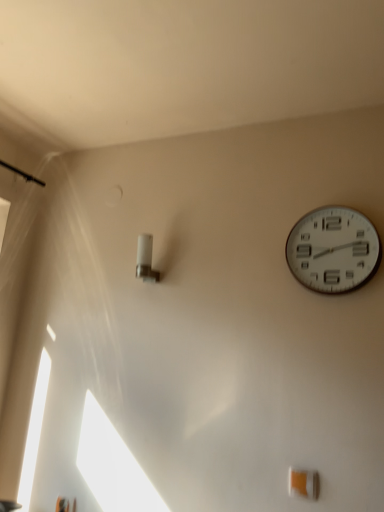
Question: Considering the relative sizes of white plastic light fixture at center-left and white plastic wall clock at upper right in the image provided, is white plastic light fixture at center-left wider than white plastic wall clock at upper right?

Choices:
 (A) no
 (B) yes

Answer: (B)

Question: From a real-world perspective, is white plastic light fixture at center-left located higher than white plastic wall clock at upper right?

Choices:
 (A) no
 (B) yes

Answer: (A)

Question: From the image's perspective, is white plastic light fixture at center-left located above white plastic wall clock at upper right?

Choices:
 (A) yes
 (B) no

Answer: (B)

Question: From the image's perspective, does white plastic light fixture at center-left appear lower than white plastic wall clock at upper right?

Choices:
 (A) yes
 (B) no

Answer: (A)

Question: Are white plastic light fixture at center-left and white plastic wall clock at upper right far apart?

Choices:
 (A) no
 (B) yes

Answer: (A)

Question: Can you confirm if white plastic light fixture at center-left is smaller than white plastic wall clock at upper right?

Choices:
 (A) no
 (B) yes

Answer: (B)

Question: Can you confirm if white plastic wall clock at upper right is taller than white plastic light fixture at center-left?

Choices:
 (A) yes
 (B) no

Answer: (A)

Question: Is white plastic wall clock at upper right at the right side of white plastic light fixture at center-left?

Choices:
 (A) yes
 (B) no

Answer: (A)

Question: Is white plastic wall clock at upper right placed right next to white plastic light fixture at center-left?

Choices:
 (A) yes
 (B) no

Answer: (B)

Question: Could you tell me if white plastic wall clock at upper right is turned towards white plastic light fixture at center-left?

Choices:
 (A) no
 (B) yes

Answer: (A)

Question: Does white plastic wall clock at upper right lie in front of white plastic light fixture at center-left?

Choices:
 (A) no
 (B) yes

Answer: (B)

Question: From a real-world perspective, does white plastic wall clock at upper right stand above white plastic light fixture at center-left?

Choices:
 (A) no
 (B) yes

Answer: (B)

Question: In terms of width, does white plastic wall clock at upper right look wider or thinner when compared to white plastic light fixture at center-left?

Choices:
 (A) thin
 (B) wide

Answer: (A)